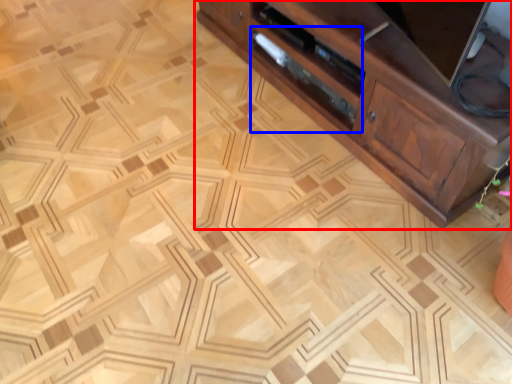
Question: Which of the following is the farthest to the observer, cabinetry (highlighted by a red box) or drawer (highlighted by a blue box)?

Choices:
 (A) cabinetry
 (B) drawer

Answer: (B)